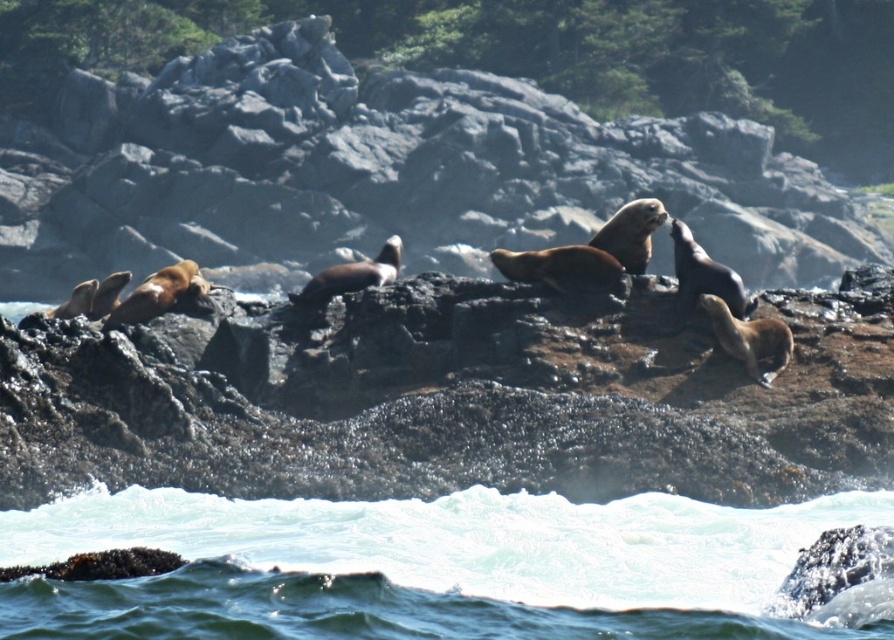
Between point (7, 468) and point (681, 200), which one is positioned in front?

Point (7, 468) is more forward.

Can you confirm if brown rough rock at center is positioned below brown fur seal at center?

Indeed, brown rough rock at center is positioned under brown fur seal at center.

Find the location of a particular element. The image size is (894, 640). brown rough rock at center is located at coordinates 453,401.

I want to click on brown rough rock at center, so click(453, 401).

Can you confirm if brown rough rock at center is positioned above clear water at lower center?

Yes, brown rough rock at center is above clear water at lower center.

Image resolution: width=894 pixels, height=640 pixels. What do you see at coordinates (453, 401) in the screenshot? I see `brown rough rock at center` at bounding box center [453, 401].

Describe the element at coordinates (453, 401) in the screenshot. I see `brown rough rock at center` at that location.

The image size is (894, 640). I want to click on brown rough rock at center, so click(453, 401).

Is brown fur seal at center behind clear water at lower center?

Yes.

Describe the element at coordinates (384, 172) in the screenshot. The width and height of the screenshot is (894, 640). I see `brown fur seal at center` at that location.

You are a GUI agent. You are given a task and a screenshot of the screen. Output one action in this format:
    pyautogui.click(x=<x>, y=<y>)
    Task: Click on the brown fur seal at center
    
    Given the screenshot: What is the action you would take?
    [x=384, y=172]